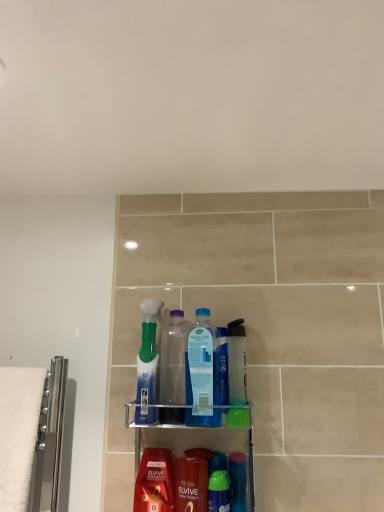
Question: From the image's perspective, relative to shiny red shampoo at lower center, is blue plastic bottle at center, the 3th bottle in the left-to-right sequence, above or below?

Choices:
 (A) below
 (B) above

Answer: (B)

Question: Is blue plastic bottle at center, the 3th bottle in the left-to-right sequence, situated inside shiny red shampoo at lower center or outside?

Choices:
 (A) inside
 (B) outside

Answer: (B)

Question: Which of these objects is positioned farthest from the blue plastic bottle at center, the 3th bottle in the left-to-right sequence?

Choices:
 (A) transparent plastic bottle at center, the second bottle viewed from the right
 (B) translucent plastic bottle at center, which appears as the fourth mouthwash when viewed from the left
 (C) translucent green bottle at center, the first bottle viewed from the left
 (D) translucent plastic mouthwash at lower center, arranged as the 2th mouthwash when viewed from the right
 (E) green plastic mouthwash at center, which appears as the 2th mouthwash when viewed from the left

Answer: (E)

Question: Which of these objects is positioned farthest from the transparent plastic bottle at center, which ranks as the second bottle in left-to-right order?

Choices:
 (A) translucent plastic bottles at center
 (B) translucent plastic mouthwash at lower center, which is the fourth mouthwash from right to left
 (C) translucent plastic bottle at center, which appears as the fourth mouthwash when viewed from the left
 (D) blue plastic bottle at center, marked as the first bottle in a right-to-left arrangement
 (E) shiny red shampoo at lower center

Answer: (E)